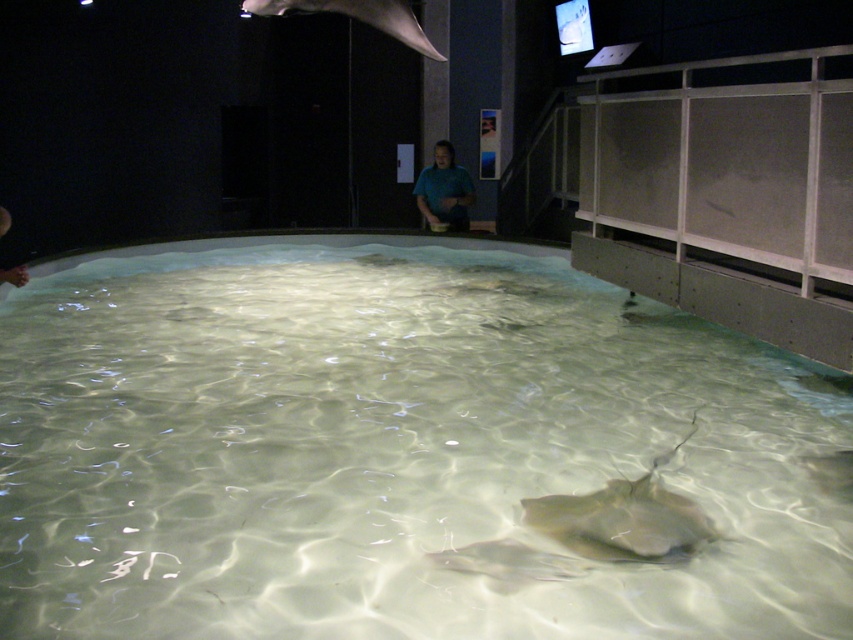
Is point (357, 417) closer to camera compared to point (524, 520)?

No, (357, 417) is further to viewer.

Who is more forward, (270, 250) or (608, 492)?

Point (608, 492) is more forward.

The height and width of the screenshot is (640, 853). What are the coordinates of `clear glass swimming pool at center` in the screenshot? It's located at (393, 449).

How much distance is there between clear glass swimming pool at center and blue matte shirt at center?

They are 3.78 meters apart.

Does clear glass swimming pool at center have a greater width compared to blue matte shirt at center?

Yes, clear glass swimming pool at center is wider than blue matte shirt at center.

I want to click on clear glass swimming pool at center, so click(393, 449).

The image size is (853, 640). In order to click on clear glass swimming pool at center in this screenshot , I will do `click(393, 449)`.

Can you confirm if clear glass swimming pool at center is bigger than smooth gray stingray at upper center?

Indeed, clear glass swimming pool at center has a larger size compared to smooth gray stingray at upper center.

Does point (129, 323) come closer to viewer compared to point (289, 8)?

No, (129, 323) is behind (289, 8).

Is point (195, 547) positioned before point (432, 45)?

Yes, point (195, 547) is closer to viewer.

Find the location of a particular element. This screenshot has height=640, width=853. clear glass swimming pool at center is located at coordinates pyautogui.click(x=393, y=449).